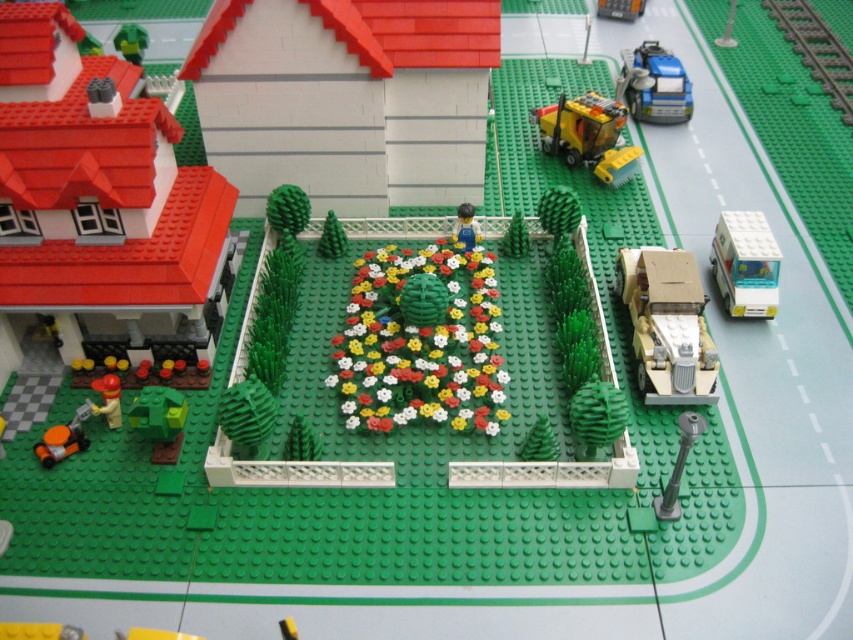
Between floral-patterned garden at center and green matte tree at center, which one has more height?

floral-patterned garden at center is taller.

Is point (412, 332) behind point (341, 228)?

No, it is not.

Who is more forward, (486, 365) or (329, 228)?

Point (486, 365) is more forward.

Identify the location of floral-patterned garden at center. The width and height of the screenshot is (853, 640). (421, 340).

Can you confirm if blue metallic truck at upper right is positioned to the left of green matte figure at upper left?

In fact, blue metallic truck at upper right is to the right of green matte figure at upper left.

Who is more forward, (679, 102) or (123, 45)?

Point (679, 102)

This screenshot has width=853, height=640. Find the location of `blue metallic truck at upper right`. blue metallic truck at upper right is located at coordinates (654, 84).

The image size is (853, 640). In order to click on yellow plastic bulldozer at upper center in this screenshot , I will do `click(587, 134)`.

Looking at this image, between yellow plastic bulldozer at upper center and smooth plastic figure at center, which one appears on the right side from the viewer's perspective?

yellow plastic bulldozer at upper center

The image size is (853, 640). I want to click on yellow plastic bulldozer at upper center, so click(587, 134).